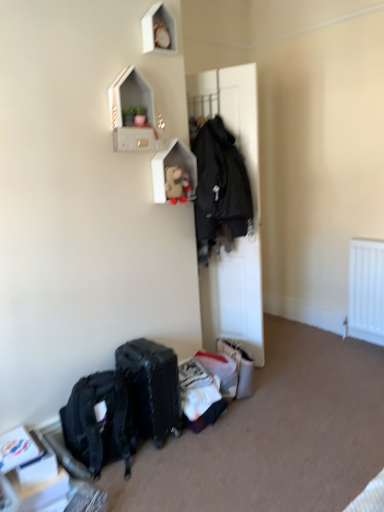
Question: Is black matte door at center wider or thinner than wooden shelf at upper center, arranged as the first shelf when viewed from the back?

Choices:
 (A) thin
 (B) wide

Answer: (B)

Question: Looking at the image, does black matte door at center seem bigger or smaller compared to wooden shelf at upper center, arranged as the first shelf when viewed from the back?

Choices:
 (A) big
 (B) small

Answer: (A)

Question: Estimate the real-world distances between objects in this image. Which object is farther from the fuzzy fabric teddy bear at upper center?

Choices:
 (A) wooden shelf at upper center, marked as the second shelf in a front-to-back arrangement
 (B) black matte door at center
 (C) matte black backpack at lower left
 (D) matte black suitcase at lower center
 (E) concrete textured shelf at upper center, which is the first shelf from front to back

Answer: (C)

Question: Which object is positioned closest to the fuzzy fabric teddy bear at upper center?

Choices:
 (A) wooden shelf at upper center, arranged as the first shelf when viewed from the back
 (B) concrete textured shelf at upper center, which is the first shelf from front to back
 (C) matte black suitcase at lower center
 (D) matte black backpack at lower left
 (E) black matte door at center

Answer: (A)